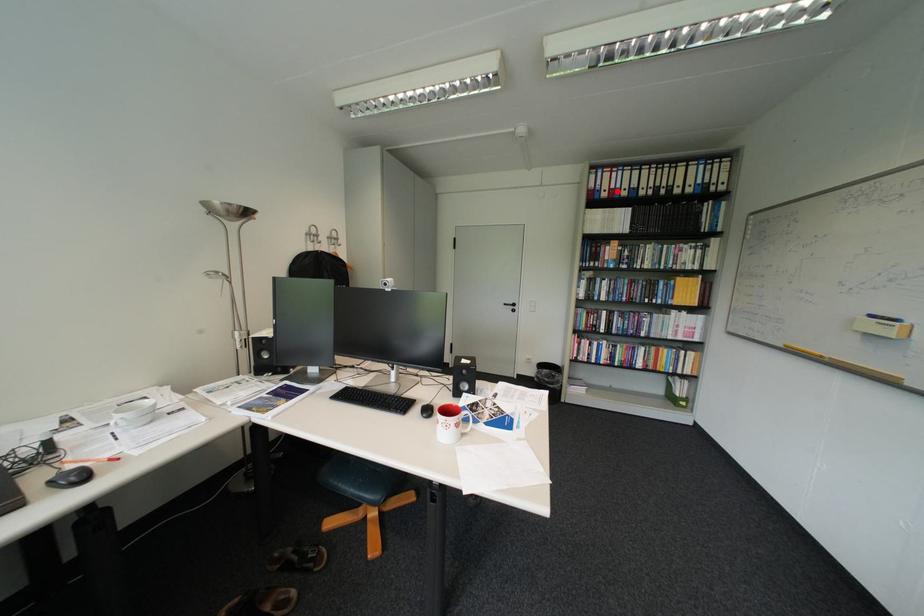
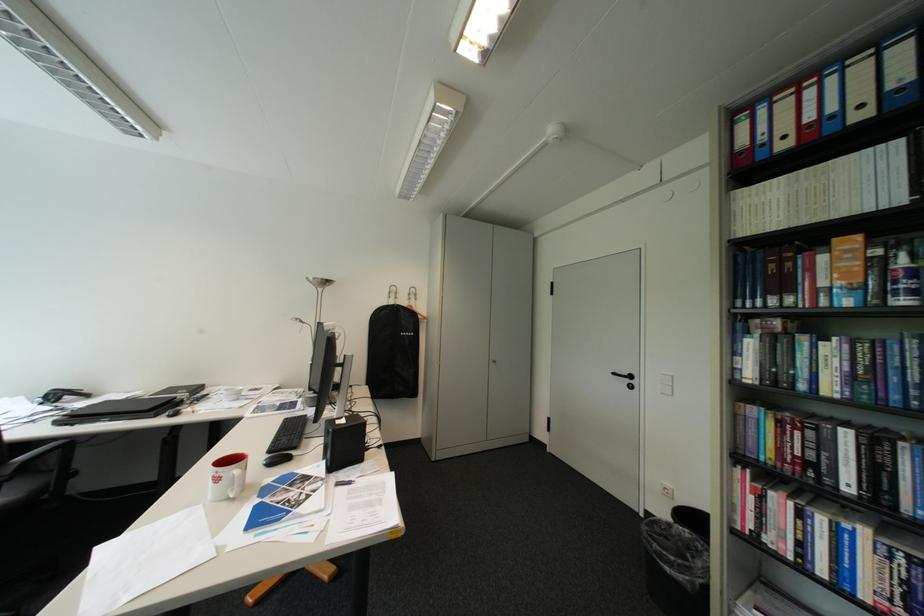
In the second image, find the point that corresponds to the highlighted location in the first image.

(796, 138)